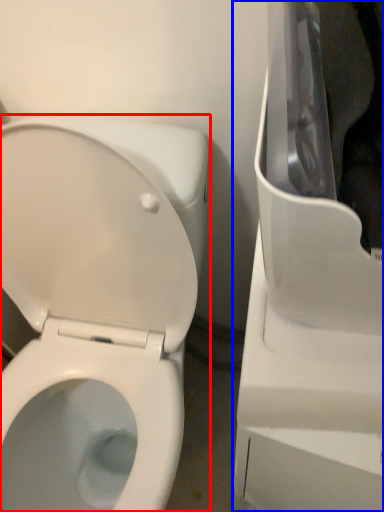
Question: Among these objects, which one is nearest to the camera, toilet (highlighted by a red box) or appliance (highlighted by a blue box)?

Choices:
 (A) toilet
 (B) appliance

Answer: (B)